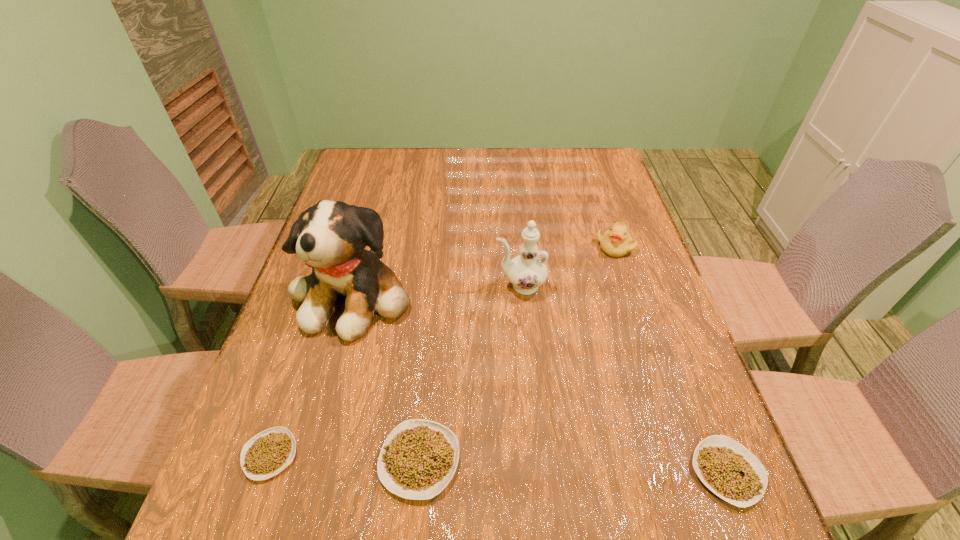
Where is `free region located on the right of the shortest object`? free region located on the right of the shortest object is located at coordinates (447, 455).

This screenshot has height=540, width=960. Identify the location of vacant area located 0.180m on the left of the third shortest object. (282, 460).

Where is `free region located 0.350m on the left of the rightmost legume`? The height and width of the screenshot is (540, 960). free region located 0.350m on the left of the rightmost legume is located at coordinates 499,472.

This screenshot has width=960, height=540. I want to click on free space located 0.310m on the front-facing side of the duckling, so click(x=649, y=353).

Where is `free region located 0.070m at the face of the puppy`? free region located 0.070m at the face of the puppy is located at coordinates (333, 372).

You are a GUI agent. You are given a task and a screenshot of the screen. Output one action in this format:
    pyautogui.click(x=<x>, y=<y>)
    Task: Click on the vacant space located at the spout of the second tallest object
    This screenshot has height=540, width=960.
    Given the screenshot: What is the action you would take?
    pyautogui.click(x=362, y=286)

The image size is (960, 540). Identify the location of free region located at the spout of the second tallest object. (405, 286).

This screenshot has width=960, height=540. I want to click on vacant region located at the spout of the second tallest object, so click(x=370, y=286).

At what (x,y) coordinates should I click in order to perform the action: click on legume at the left edge. Please return your answer as a coordinate pair (x, y). Looking at the image, I should click on (269, 452).

Find the location of a particular element. This screenshot has width=960, height=540. puppy located at the left edge is located at coordinates [331, 236].